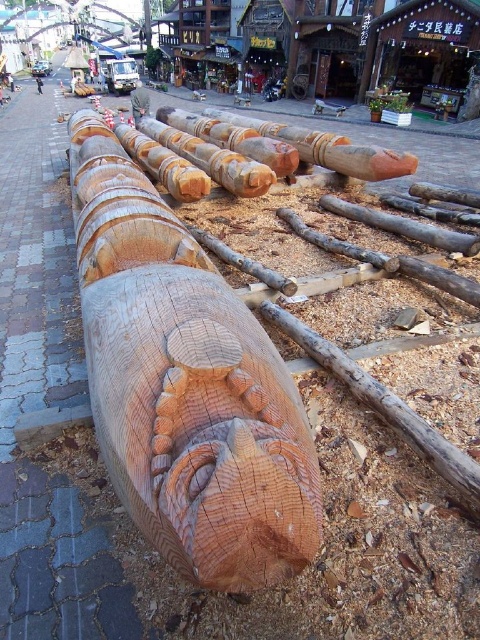
Question: Which of the following is the farthest from the observer?

Choices:
 (A) smooth brown tree trunk at center
 (B) natural wood carving at center

Answer: (A)

Question: Does natural wood carving at center appear over smooth brown tree trunk at center?

Choices:
 (A) yes
 (B) no

Answer: (B)

Question: Does natural wood carving at center appear on the left side of smooth brown tree trunk at center?

Choices:
 (A) yes
 (B) no

Answer: (B)

Question: Which point is closer to the camera?

Choices:
 (A) (142, 202)
 (B) (152, 49)

Answer: (A)

Question: Is natural wood carving at center to the left of smooth brown tree trunk at center from the viewer's perspective?

Choices:
 (A) yes
 (B) no

Answer: (B)